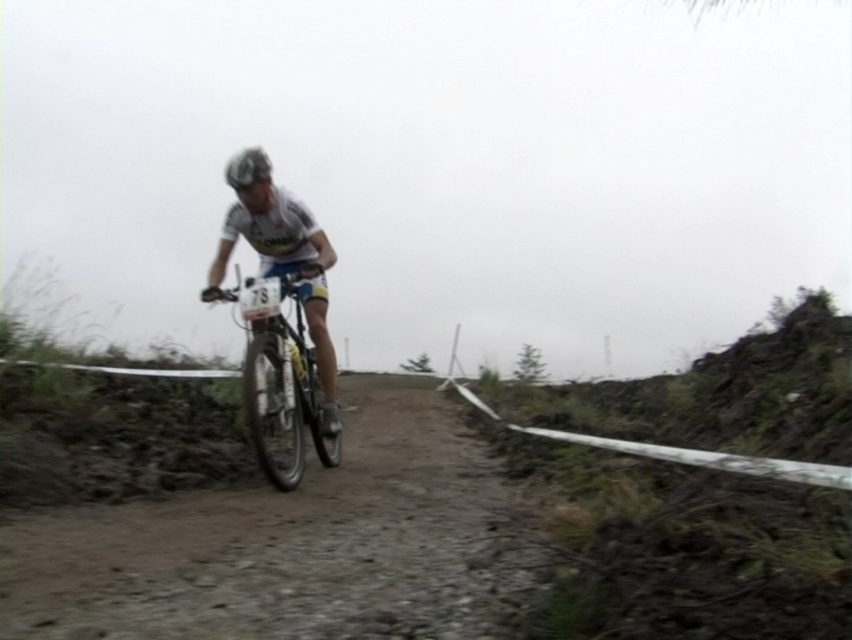
Which is in front, point (289, 362) or point (239, 189)?

Point (239, 189) is more forward.

Which is above, shiny metallic bicycle at center or shiny silver helmet at center?

shiny silver helmet at center is higher up.

You are a GUI agent. You are given a task and a screenshot of the screen. Output one action in this format:
    pyautogui.click(x=<x>, y=<y>)
    Task: Click on the shiny metallic bicycle at center
    
    Given the screenshot: What is the action you would take?
    pyautogui.click(x=280, y=380)